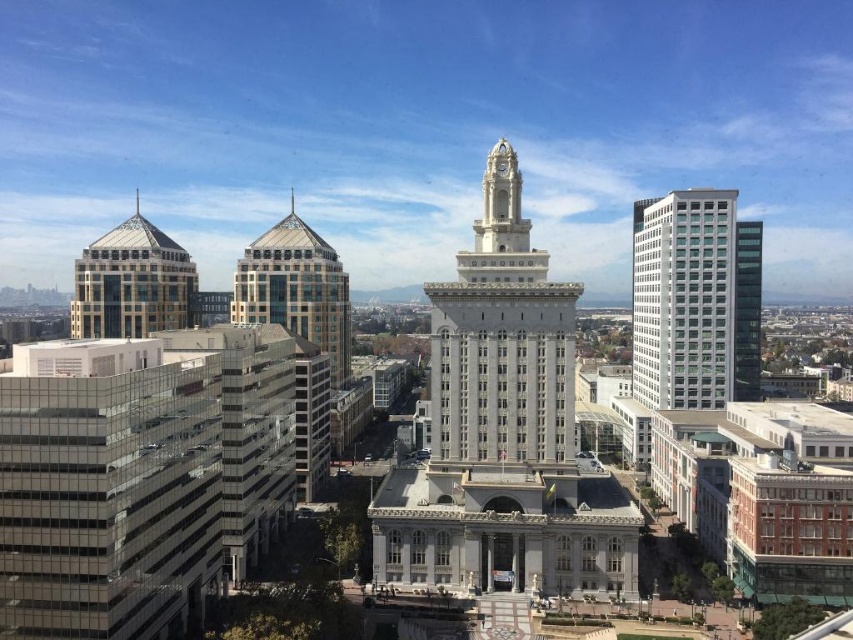
Question: In this image, where is white stone clock tower at center located relative to gold glass dome at left?

Choices:
 (A) right
 (B) left

Answer: (A)

Question: Estimate the real-world distances between objects in this image. Which object is closer to the gold glass dome at left?

Choices:
 (A) white stone clock tower at center
 (B) white glass building at right
 (C) glassy reflective skyscraper at center-left

Answer: (C)

Question: Which point is farther from the camera taking this photo?

Choices:
 (A) (727, 316)
 (B) (526, 264)

Answer: (A)

Question: Which point appears closest to the camera in this image?

Choices:
 (A) (71, 326)
 (B) (488, 344)

Answer: (B)

Question: Can you confirm if white stone clock tower at center is positioned below white glass building at right?

Choices:
 (A) yes
 (B) no

Answer: (A)

Question: Does white stone clock tower at center come in front of glassy reflective skyscraper at center-left?

Choices:
 (A) yes
 (B) no

Answer: (A)